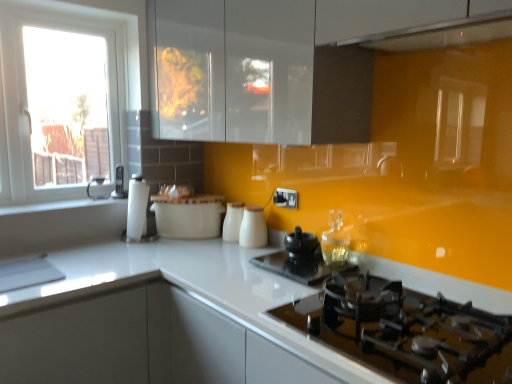
Describe the element at coordinates (406, 332) in the screenshot. This screenshot has height=384, width=512. I see `black glass gas stove at lower right` at that location.

You are a GUI agent. You are given a task and a screenshot of the screen. Output one action in this format:
    pyautogui.click(x=<x>, y=<y>)
    Task: Click on the white glossy countertop at center
    
    Given the screenshot: What is the action you would take?
    pyautogui.click(x=188, y=288)

You are a GUI agent. You are given a task and a screenshot of the screen. Output one action in this format:
    pyautogui.click(x=<x>, y=<y>)
    Task: Click on the black glass kettle at center, the first appliance viewed from the front
    Image resolution: width=512 pixels, height=384 pixels.
    Given the screenshot: What is the action you would take?
    pyautogui.click(x=295, y=266)

Where is `glossy white exhaust hood at upper center`? Image resolution: width=512 pixels, height=384 pixels. glossy white exhaust hood at upper center is located at coordinates (440, 33).

Is white glossy window at left directly adjacent to white glossy cabinet at lower left?

No, white glossy window at left is not next to white glossy cabinet at lower left.

Can you confirm if white glossy window at left is smaller than white glossy cabinet at lower left?

Indeed, white glossy window at left has a smaller size compared to white glossy cabinet at lower left.

Which is in front, point (66, 117) or point (76, 359)?

The point (76, 359) is in front.

Which object is closer to the camera taking this photo, white glossy window at left or white glossy cabinet at lower left?

white glossy cabinet at lower left.

Does white glossy milk jugs at center, which is the 3th kitchen appliance in left-to-right order, turn towards white glossy cabinet at lower left?

No.

Can you tell me how much white glossy milk jugs at center, placed as the 1th kitchen appliance when sorted from right to left, and white glossy cabinet at lower left differ in facing direction?

The angle between the facing direction of white glossy milk jugs at center, placed as the 1th kitchen appliance when sorted from right to left, and the facing direction of white glossy cabinet at lower left is 91.3 degrees.

Is white glossy milk jugs at center, placed as the 1th kitchen appliance when sorted from right to left, surrounding white glossy cabinet at lower left?

No, white glossy cabinet at lower left is not a part of white glossy milk jugs at center, placed as the 1th kitchen appliance when sorted from right to left.

Which kitchen appliance is the 3rd one when counting from the right side of the white glossy cabinet at lower left? Please provide its 2D coordinates.

[(253, 228)]

From a real-world perspective, does white glossy milk jugs at center, placed as the 1th kitchen appliance when sorted from right to left, stand above black ceramic kettle at center, marked as the 2th appliance in a bottom-to-top arrangement?

Correct, in the physical world, white glossy milk jugs at center, placed as the 1th kitchen appliance when sorted from right to left, is higher than black ceramic kettle at center, marked as the 2th appliance in a bottom-to-top arrangement.

Considering the positions of objects white glossy milk jugs at center, placed as the 1th kitchen appliance when sorted from right to left, and black ceramic kettle at center, the second appliance when ordered from back to front, in the image provided, who is more to the left, white glossy milk jugs at center, placed as the 1th kitchen appliance when sorted from right to left, or black ceramic kettle at center, the second appliance when ordered from back to front,?

white glossy milk jugs at center, placed as the 1th kitchen appliance when sorted from right to left, is more to the left.

Looking at their sizes, would you say white glossy milk jugs at center, placed as the 1th kitchen appliance when sorted from right to left, is wider or thinner than black ceramic kettle at center, which ranks as the first appliance in right-to-left order?

In the image, white glossy milk jugs at center, placed as the 1th kitchen appliance when sorted from right to left, appears to be more narrow than black ceramic kettle at center, which ranks as the first appliance in right-to-left order.

Is white glossy milk jugs at center, which is the 3th kitchen appliance in left-to-right order, turned away from black ceramic kettle at center, which appears as the second appliance when viewed from the top?

white glossy milk jugs at center, which is the 3th kitchen appliance in left-to-right order, is not turned away from black ceramic kettle at center, which appears as the second appliance when viewed from the top.

At what (x,y) coordinates should I click in order to perform the action: click on window sill below the matte black kettle at left, acting as the 3th appliance starting from the bottom (from the image's perspective). Please return your answer as a coordinate pair (x, y). Looking at the image, I should click on (59, 206).

Is matte black kettle at left, which is the first appliance in left-to-right order, thinner than white glossy window sill at left?

Correct, the width of matte black kettle at left, which is the first appliance in left-to-right order, is less than that of white glossy window sill at left.

Between matte black kettle at left, the first appliance in the back-to-front sequence, and white glossy window sill at left, which one appears on the left side from the viewer's perspective?

white glossy window sill at left.

Considering the relative sizes of black glass kettle at center, marked as the 3th appliance in a top-to-bottom arrangement, and white glossy window at left in the image provided, is black glass kettle at center, marked as the 3th appliance in a top-to-bottom arrangement, smaller than white glossy window at left?

Yes, black glass kettle at center, marked as the 3th appliance in a top-to-bottom arrangement, is smaller than white glossy window at left.

From the image's perspective, is black glass kettle at center, the first appliance when ordered from bottom to top, over white glossy window at left?

No.

Which object is positioned more to the right, black glass kettle at center, the first appliance viewed from the front, or white glossy window at left?

From the viewer's perspective, black glass kettle at center, the first appliance viewed from the front, appears more on the right side.

Is black glass kettle at center, positioned as the second appliance in left-to-right order, aimed at white glossy window at left?

No, black glass kettle at center, positioned as the second appliance in left-to-right order, is not turned towards white glossy window at left.

Considering the relative positions of black glass gas stove at lower right and black ceramic kettle at center, the second appliance when ordered from back to front, in the image provided, is black glass gas stove at lower right in front of black ceramic kettle at center, the second appliance when ordered from back to front,?

Yes, black glass gas stove at lower right is closer to the camera.

How distant is black glass gas stove at lower right from black ceramic kettle at center, which appears as the second appliance when viewed from the top?

The distance of black glass gas stove at lower right from black ceramic kettle at center, which appears as the second appliance when viewed from the top, is 58.19 centimeters.

Considering the relative positions of black glass gas stove at lower right and black ceramic kettle at center, which appears as the second appliance when viewed from the top, in the image provided, is black glass gas stove at lower right to the left or to the right of black ceramic kettle at center, which appears as the second appliance when viewed from the top,?

black glass gas stove at lower right is to the right of black ceramic kettle at center, which appears as the second appliance when viewed from the top.

From the image's perspective, between black glass gas stove at lower right and black ceramic kettle at center, the second appliance when ordered from back to front, who is located below?

From the image's view, black glass gas stove at lower right is below.

Does white glossy cabinet at lower left have a greater width compared to black glass gas stove at lower right?

Indeed, white glossy cabinet at lower left has a greater width compared to black glass gas stove at lower right.

In the scene shown: Is white glossy cabinet at lower left taller than black glass gas stove at lower right?

Indeed, white glossy cabinet at lower left has a greater height compared to black glass gas stove at lower right.

Measure the distance between white glossy cabinet at lower left and black glass gas stove at lower right.

36.79 inches.

Considering the positions of objects white glossy cabinet at lower left and black glass gas stove at lower right in the image provided, who is behind, white glossy cabinet at lower left or black glass gas stove at lower right?

white glossy cabinet at lower left is more distant.

What are the coordinates of `cabinetry below the white glossy window at left (from a real-world perspective)` in the screenshot? It's located at (79, 342).

Find the location of a particular element. This screenshot has height=384, width=512. cabinetry that appears below the white glossy milk jugs at center, placed as the 1th kitchen appliance when sorted from right to left (from the image's perspective) is located at coordinates coord(79,342).

Looking at the image, which one is located further to matte black kettle at left, the 3th appliance viewed from the front, white glossy milk jugs at center, which is the 3th kitchen appliance in left-to-right order, or black glass gas stove at lower right?

Among the two, black glass gas stove at lower right is located further to matte black kettle at left, the 3th appliance viewed from the front.

Estimate the real-world distances between objects in this image. Which object is further from black glass kettle at center, the first appliance viewed from the front, black glass gas stove at lower right or matte black kettle at left, marked as the third appliance in a right-to-left arrangement?

matte black kettle at left, marked as the third appliance in a right-to-left arrangement, lies further to black glass kettle at center, the first appliance viewed from the front, than the other object.

Estimate the real-world distances between objects in this image. Which object is further from glossy white exhaust hood at upper center, black glass kettle at center, marked as the 3th appliance in a top-to-bottom arrangement, or black ceramic kettle at center, the 2th appliance in the front-to-back sequence?

black ceramic kettle at center, the 2th appliance in the front-to-back sequence.

Estimate the real-world distances between objects in this image. Which object is closer to white glossy cabinet at lower left, white glossy coffee machine at center or white glossy window at left?

white glossy coffee machine at center is positioned closer to the anchor white glossy cabinet at lower left.

Based on the photo, considering their positions, is white glossy window at left positioned closer to black ceramic kettle at center, which ranks as the first appliance in right-to-left order, than white glossy milk jugs at center, the second kitchen appliance in the right-to-left sequence?

white glossy milk jugs at center, the second kitchen appliance in the right-to-left sequence, lies closer to black ceramic kettle at center, which ranks as the first appliance in right-to-left order, than the other object.

Considering their positions, is white glossy milk jugs at center, which is counted as the second kitchen appliance, starting from the left, positioned closer to white glossy countertop at center than white glossy milk jugs at center, placed as the 1th kitchen appliance when sorted from right to left?

Based on the image, white glossy milk jugs at center, placed as the 1th kitchen appliance when sorted from right to left, appears to be nearer to white glossy countertop at center.

In the scene shown: From the image, which object appears to be farther from white glossy coffee machine at center, white glossy window sill at left or white glossy cabinet at lower left?

Among the two, white glossy cabinet at lower left is located further to white glossy coffee machine at center.

When comparing their distances from black glass gas stove at lower right, does glossy white exhaust hood at upper center or white glossy coffee machine at center seem closer?

glossy white exhaust hood at upper center lies closer to black glass gas stove at lower right than the other object.

The width and height of the screenshot is (512, 384). Identify the location of countertop located between white glossy window sill at left and glossy white exhaust hood at upper center in the left-right direction. (188, 288).

Locate an element on the screen. The width and height of the screenshot is (512, 384). window sill located between white glossy window at left and white glossy milk jugs at center, which is counted as the second kitchen appliance, starting from the left, in the left-right direction is located at coordinates (59, 206).

Where is `window sill situated between white glossy window at left and glossy white exhaust hood at upper center from left to right`? This screenshot has width=512, height=384. window sill situated between white glossy window at left and glossy white exhaust hood at upper center from left to right is located at coordinates (59, 206).

Where is `coffee machine between white glossy window sill at left and matte black kettle at left, acting as the 3th appliance starting from the bottom, from front to back`? The width and height of the screenshot is (512, 384). coffee machine between white glossy window sill at left and matte black kettle at left, acting as the 3th appliance starting from the bottom, from front to back is located at coordinates (139, 212).